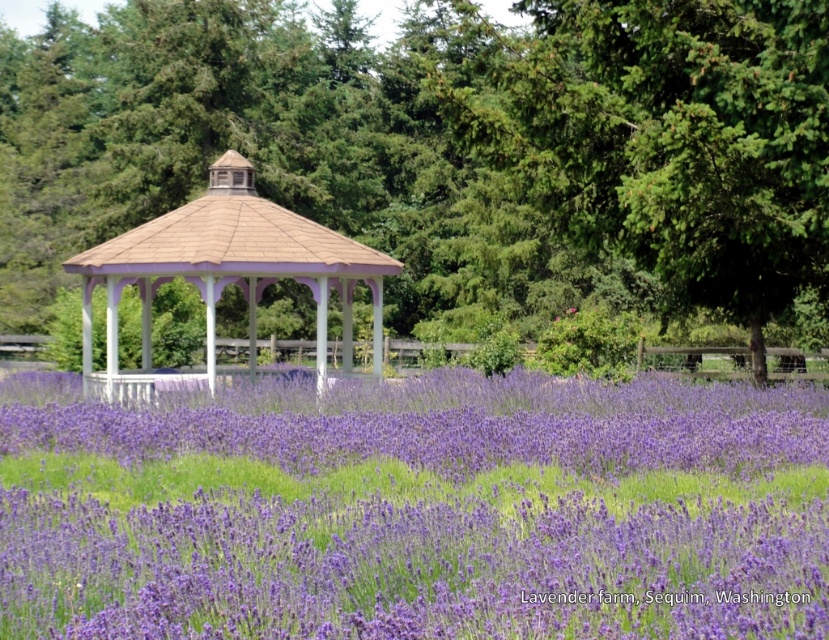
You are standing in the lavender field and want to take a photo of both the green leafy tree at center and the purple soft lavender at center. Which object should you frame first in your camera to ensure both are visible in the shot?

You should frame the green leafy tree at center first because it is positioned on the left side of the purple soft lavender at center, so by starting with the tree, you can ensure both objects are included in the photo.

You are planning to take a photo of the green leafy tree at center and the matte white gazebo at center in the lavender farm. Based on their sizes, which one should you focus on to fill the frame more effectively?

The green leafy tree at center is larger in size than the matte white gazebo at center, so focusing on the green leafy tree at center will fill the frame more effectively.